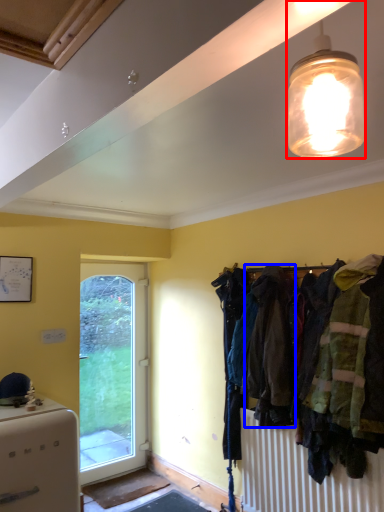
Question: Which of the following is the closest to the observer, lamp (highlighted by a red box) or clothing (highlighted by a blue box)?

Choices:
 (A) lamp
 (B) clothing

Answer: (A)